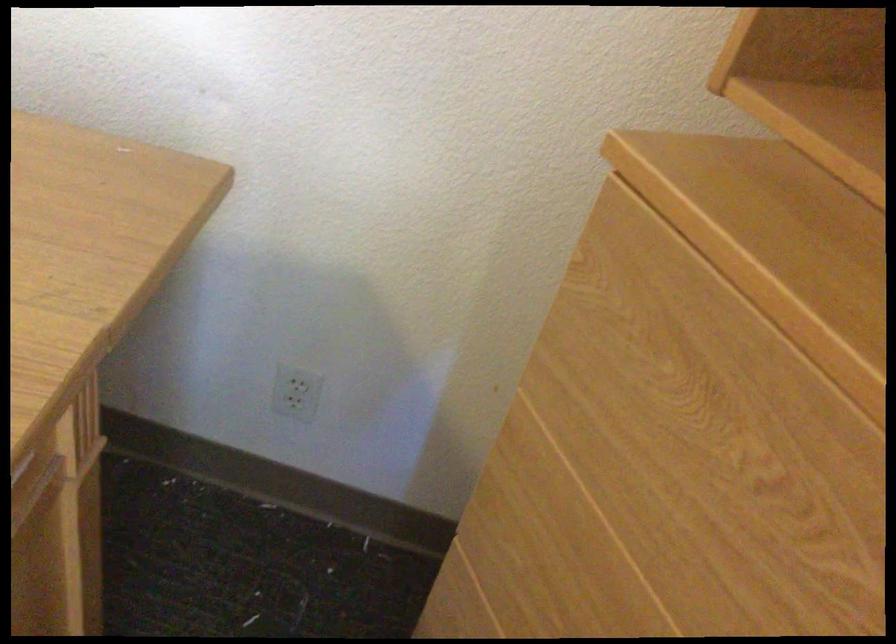
This screenshot has width=896, height=644. I want to click on wall electrical outlet, so point(296,392).